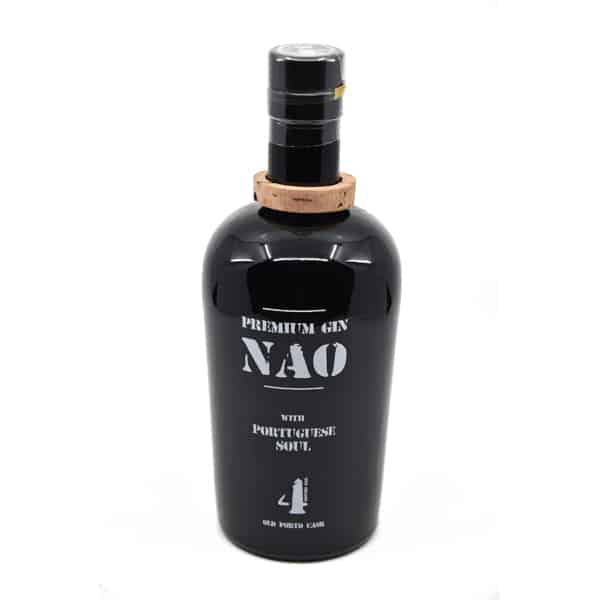
This screenshot has height=600, width=600. I want to click on reflection of lights, so click(x=240, y=260), click(x=267, y=246), click(x=298, y=255), click(x=334, y=248), click(x=358, y=258).